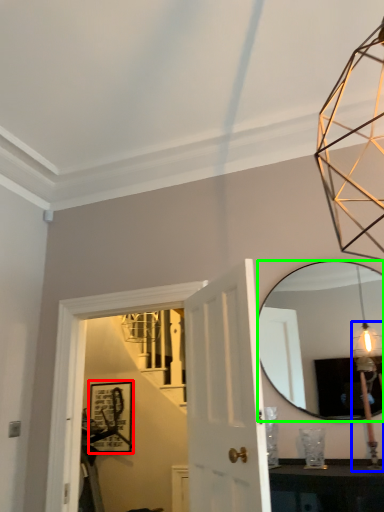
Question: Based on their relative distances, which object is nearer to picture frame (highlighted by a red box)? Choose from light fixture (highlighted by a blue box) and mirror (highlighted by a green box).

Choices:
 (A) light fixture
 (B) mirror

Answer: (B)